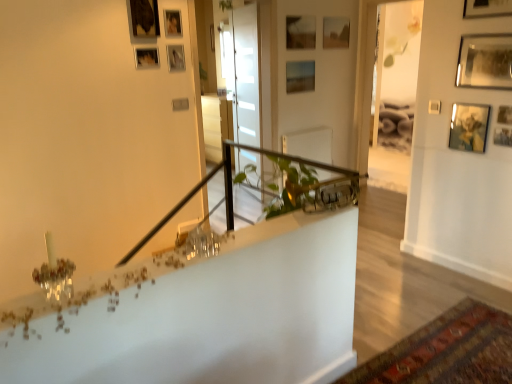
Question: Considering the positions of wooden picture frame at upper center, the sixth picture frame in the back-to-front sequence, and matte wooden picture frame at upper center, positioned as the sixth picture frame in right-to-left order, in the image, is wooden picture frame at upper center, the sixth picture frame in the back-to-front sequence, taller or shorter than matte wooden picture frame at upper center, positioned as the sixth picture frame in right-to-left order,?

Choices:
 (A) tall
 (B) short

Answer: (B)

Question: Considering the positions of wooden picture frame at upper center, acting as the eleventh picture frame starting from the right, and matte wooden picture frame at upper center, positioned as the sixth picture frame in right-to-left order, in the image, is wooden picture frame at upper center, acting as the eleventh picture frame starting from the right, wider or thinner than matte wooden picture frame at upper center, positioned as the sixth picture frame in right-to-left order,?

Choices:
 (A) thin
 (B) wide

Answer: (A)

Question: Estimate the real-world distances between objects in this image. Which object is closer to the wooden picture frame at upper center, the sixth picture frame viewed from the front?

Choices:
 (A) wooden picture frame at upper right, the 9th picture frame from the back
 (B) wooden picture frame at upper center, the fifth picture frame from the left
 (C) matte wooden picture frame at upper center, acting as the 9th picture frame starting from the right
 (D) wooden picture frame at upper left, which ranks as the 5th picture frame in front-to-back order
 (E) metallic silver picture frame at upper right, the 2th picture frame in the right-to-left sequence

Answer: (D)

Question: Which object is positioned closest to the metallic silver picture frame at upper right, acting as the eighth picture frame starting from the left?

Choices:
 (A) metallic gold picture frame at upper right, marked as the 4th picture frame in a front-to-back arrangement
 (B) matte wooden picture frame at upper center, the 6th picture frame from the left
 (C) transparent glass door at center
 (D) wooden picture frame at upper center, the sixth picture frame in the back-to-front sequence
 (E) wooden picture frame at upper center, which ranks as the 9th picture frame in front-to-back order

Answer: (A)